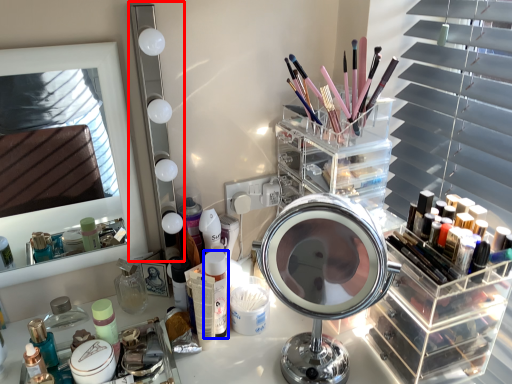
Question: Which object is closer to the camera taking this photo, mirror (highlighted by a red box) or toiletry (highlighted by a blue box)?

Choices:
 (A) mirror
 (B) toiletry

Answer: (A)